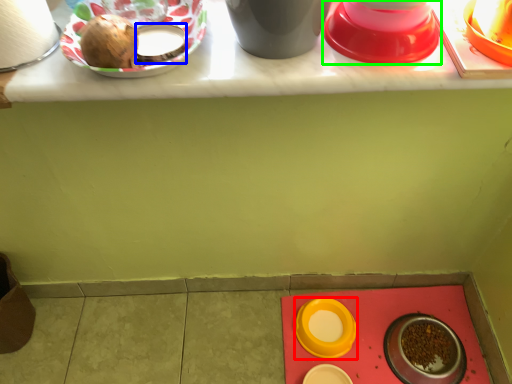
Question: Which is farther away from tableware (highlighted by a red box)? tableware (highlighted by a blue box) or tableware (highlighted by a green box)?

Choices:
 (A) tableware
 (B) tableware

Answer: (A)